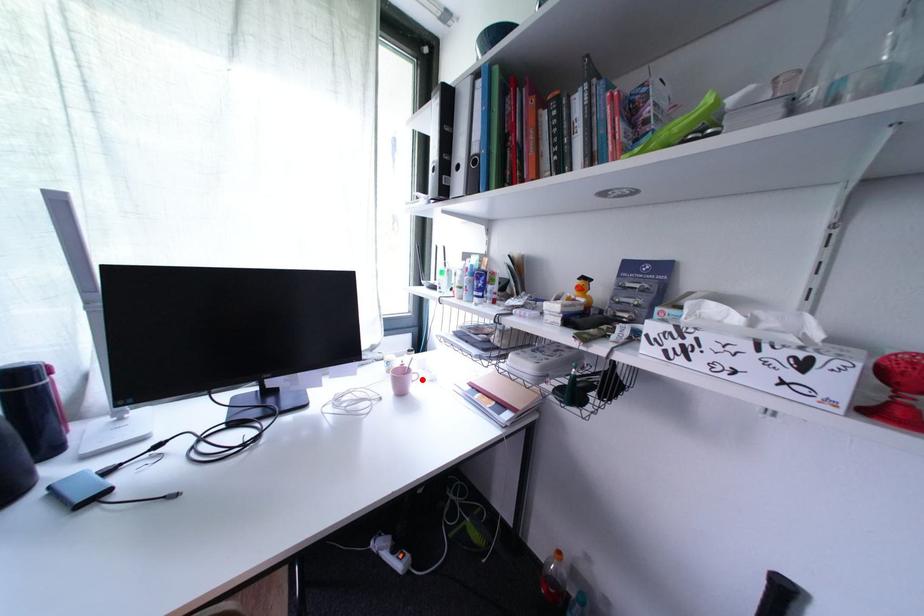
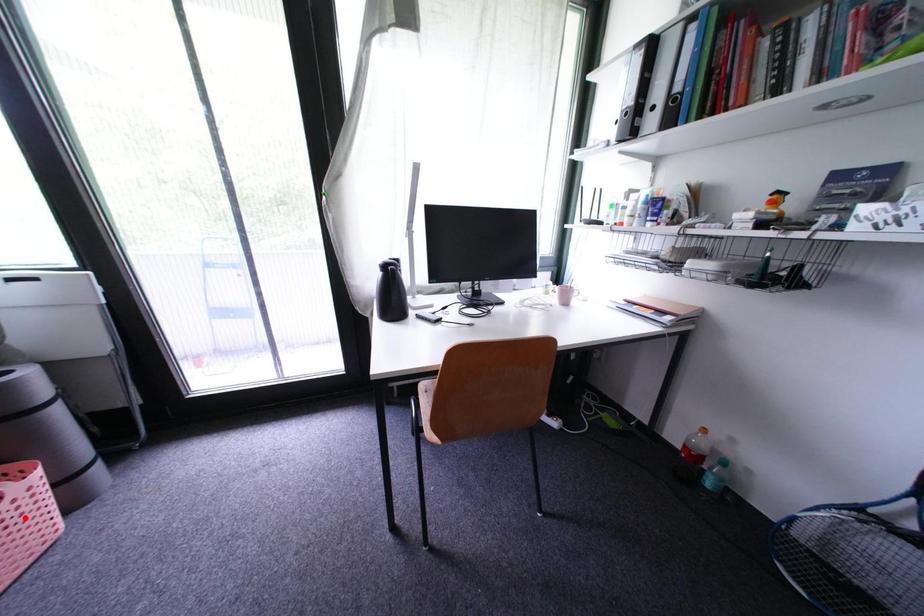
I am providing you with two images of the same scene from different viewpoints. A red point is marked on the first image and another point is marked on the second image. Is the marked point in image1 the same physical position as the marked point in image2?

No